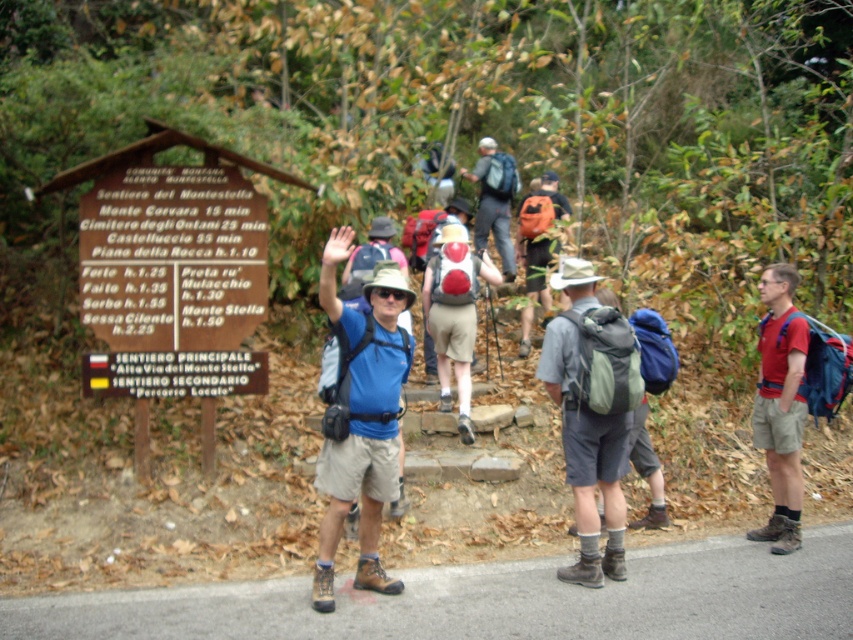
You are a hiker standing at the wooden signboard in the forest. You notice a point marked on your map at coordinates (495, 600). Where is this point located in the image?

The point marked at coordinates (495, 600) is located on the brown leather boots at lower center in the image.

You are a hiker who wants to check the trail information on the wooden signboard. You have the brown leather boots at lower center and the gray fabric backpack at center. Which item is closer to the signboard?

The brown leather boots at lower center is positioned under the gray fabric backpack at center, so the boots are closer to the signboard than the backpack.